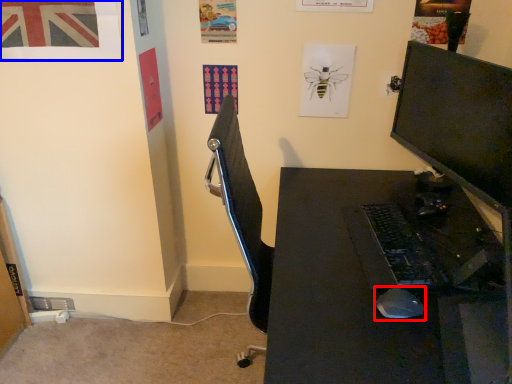
Question: Among these objects, which one is nearest to the camera, mouse (highlighted by a red box) or poster page (highlighted by a blue box)?

Choices:
 (A) mouse
 (B) poster page

Answer: (A)